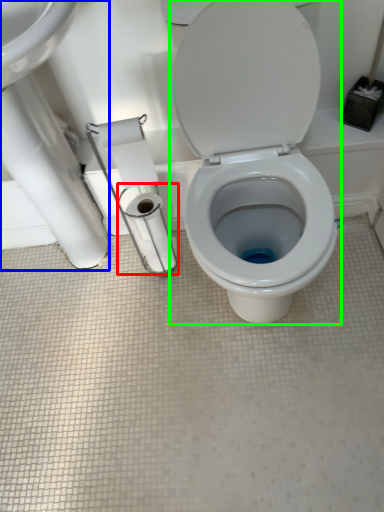
Question: Which is farther away from toilet paper (highlighted by a red box)? sink (highlighted by a blue box) or toilet (highlighted by a green box)?

Choices:
 (A) sink
 (B) toilet

Answer: (B)